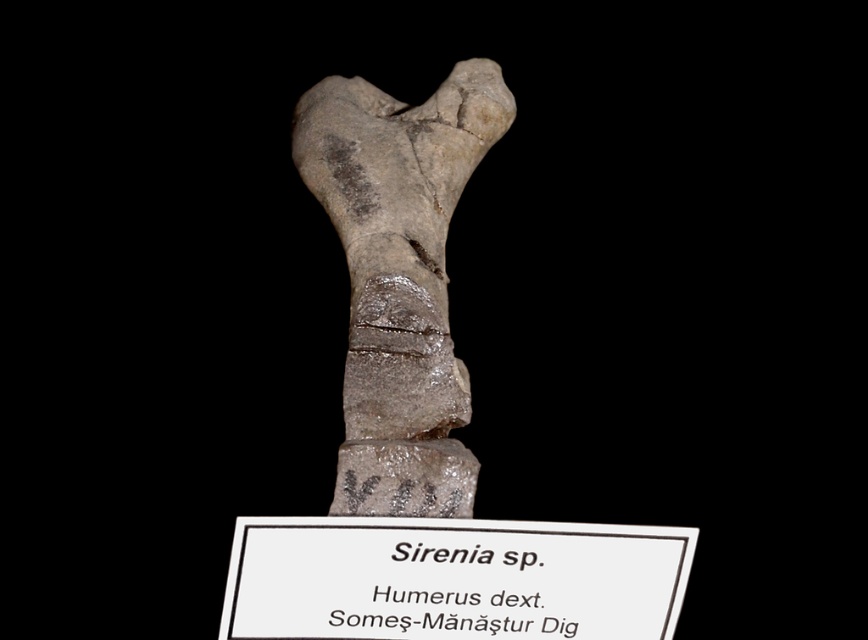
You are a paleontologist examining a fossilized humerus bone from the genus Sirenia. You notice a specific point at coordinates (399, 276). Based on the image, can you determine what structure this point is located on?

The point at coordinates (399, 276) is on the gray stone humerus at center.

You are a paleontologist examining the fossilized humerus bone. You notice a label attached to it. Is the gray stone humerus at center closer to you than the white paper at center?

Yes, the gray stone humerus at center is closer to you than the white paper at center because it is further to the viewer.

You are a paleontologist examining the fossilized humerus bone and the label in the image. The gray stone humerus at center and the white paper at center are both present. Which object is taller?

The gray stone humerus at center is taller than the white paper at center.